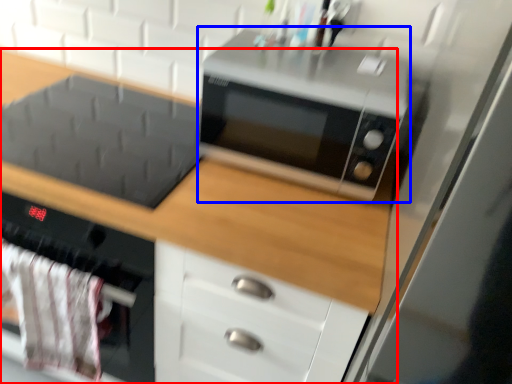
Question: Which object appears farthest to the camera in this image, cabinetry (highlighted by a red box) or microwave oven (highlighted by a blue box)?

Choices:
 (A) cabinetry
 (B) microwave oven

Answer: (B)